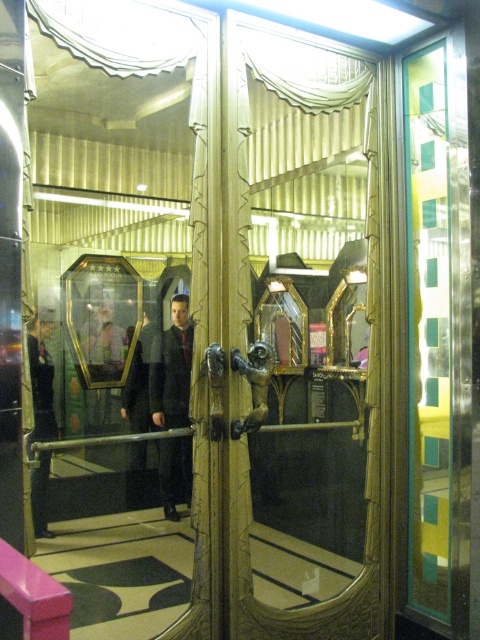
Between gold textured glass door at center and black fabric uniform at left, which one appears on the right side from the viewer's perspective?

gold textured glass door at center is more to the right.

From the picture: Can you confirm if gold textured glass door at center is wider than black fabric uniform at left?

Yes, gold textured glass door at center is wider than black fabric uniform at left.

Which is in front, point (372, 92) or point (41, 400)?

Point (372, 92) is more forward.

This screenshot has width=480, height=640. I want to click on gold textured glass door at center, so click(369, 422).

What do you see at coordinates (171, 369) in the screenshot?
I see `dark gray fabric jacket at center` at bounding box center [171, 369].

Does dark gray fabric jacket at center have a greater height compared to black fabric uniform at left?

Yes.

Between point (168, 397) and point (51, 440), which one is positioned behind?

The point (168, 397) is more distant.

What are the coordinates of `dark gray fabric jacket at center` in the screenshot? It's located at (171, 369).

Can you confirm if gold textured glass door at center is shorter than dark gray fabric jacket at center?

No, gold textured glass door at center is not shorter than dark gray fabric jacket at center.

Who is lower down, gold textured glass door at center or dark gray fabric jacket at center?

Positioned lower is dark gray fabric jacket at center.

The height and width of the screenshot is (640, 480). Describe the element at coordinates (369, 422) in the screenshot. I see `gold textured glass door at center` at that location.

Where is `gold textured glass door at center`? gold textured glass door at center is located at coordinates (369, 422).